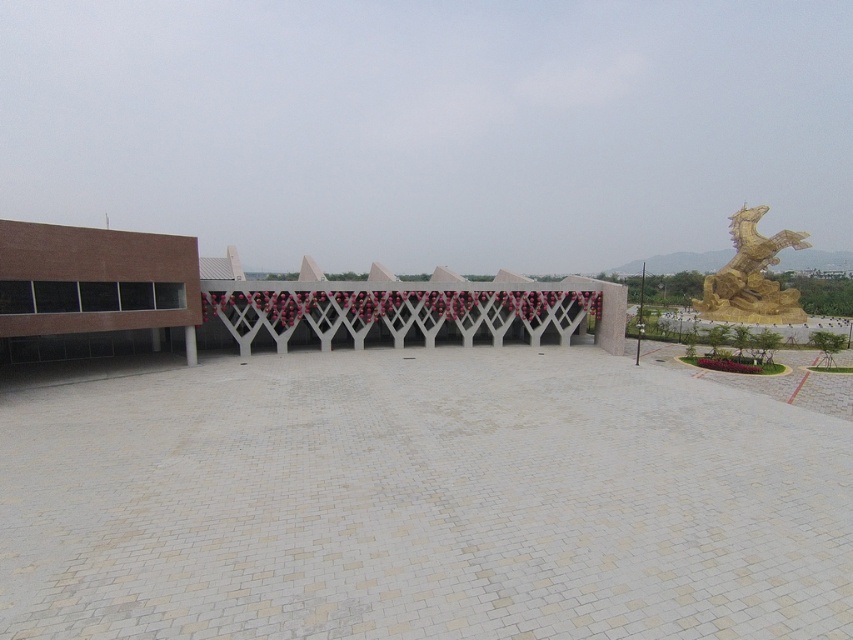
Question: Among these points, which one is farthest from the camera?

Choices:
 (A) (770, 241)
 (B) (184, 330)

Answer: (A)

Question: Is gold metallic dragon at upper right bigger than white glossy pillar at center?

Choices:
 (A) no
 (B) yes

Answer: (B)

Question: Is gold metallic dragon at upper right further to camera compared to white glossy pillar at center?

Choices:
 (A) no
 (B) yes

Answer: (B)

Question: Can you confirm if gold metallic dragon at upper right is bigger than white glossy pillar at center?

Choices:
 (A) no
 (B) yes

Answer: (B)

Question: Which object appears farthest from the camera in this image?

Choices:
 (A) gold metallic dragon at upper right
 (B) white glossy pillar at center

Answer: (A)

Question: Among these objects, which one is farthest from the camera?

Choices:
 (A) gold metallic dragon at upper right
 (B) white glossy pillar at center

Answer: (A)